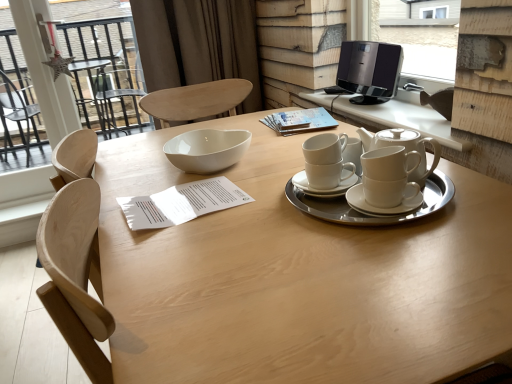
Where is `vacant space that is to the left of white ceramic cups at center`? vacant space that is to the left of white ceramic cups at center is located at coordinates (236, 226).